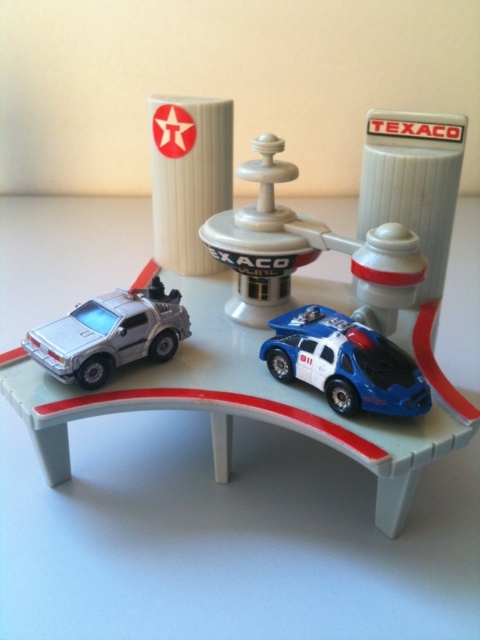
You are a child playing with the miniature toy set and want to place a toy action figure on top of the tallest vehicle. Which vehicle should you choose between the blue glossy police car at center and the silver metallic delorean at left?

The silver metallic delorean at left is taller than the blue glossy police car at center, so you should place the toy action figure on top of the silver metallic delorean at left.

You are a toy car that wants to reach the white plastic Texaco gas station at center. You are currently on the white plastic track at center. Which direction should you drive to get there?

The white plastic track at center is to the left of the white plastic Texaco gas station at center, so you should drive to the right to reach the gas station.

What is the position of the white plastic track at center in the image?

The white plastic track at center is located at point (x=250, y=401).